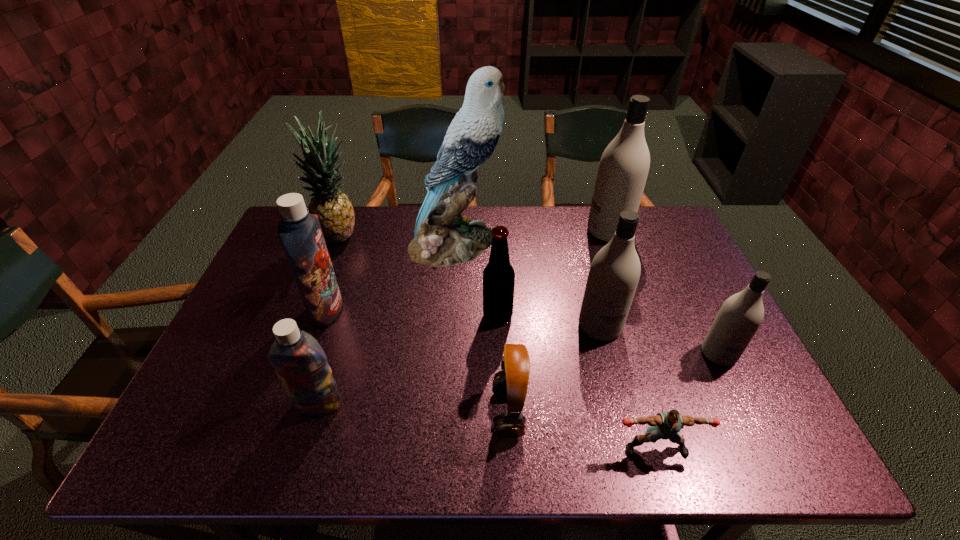
Image resolution: width=960 pixels, height=540 pixels. In the image, there is a desktop. Find the location of `vacant space at the near right corner`. vacant space at the near right corner is located at coordinates (758, 444).

I want to click on vacant space in between the bigger blue shampoo and the shortest object, so click(x=492, y=379).

Where is `free space between the second biggest white shampoo and the tallest object`? Image resolution: width=960 pixels, height=540 pixels. free space between the second biggest white shampoo and the tallest object is located at coordinates (527, 285).

Where is `free space between the second biggest white shampoo and the headset`? The height and width of the screenshot is (540, 960). free space between the second biggest white shampoo and the headset is located at coordinates (554, 369).

Locate an element on the screen. The image size is (960, 540). free space between the pineapple and the rightmost white shampoo is located at coordinates (529, 295).

The width and height of the screenshot is (960, 540). Identify the location of empty space that is in between the tallest shampoo and the shortest object. (633, 340).

Identify the location of free space between the shortest object and the farthest white shampoo. The height and width of the screenshot is (540, 960). (633, 340).

I want to click on object that stands as the sixth closest to the beer bottle, so click(x=624, y=165).

Locate which object is the fifth closest to the second smallest white shampoo. Please provide its 2D coordinates. Your answer should be formatted as a tuple, i.e. [(x, y)], where the tuple contains the x and y coordinates of a point satisfying the conditions above.

[(443, 237)]

The image size is (960, 540). What are the coordinates of `shampoo that is the third nearest to the beer bottle` in the screenshot? It's located at (624, 165).